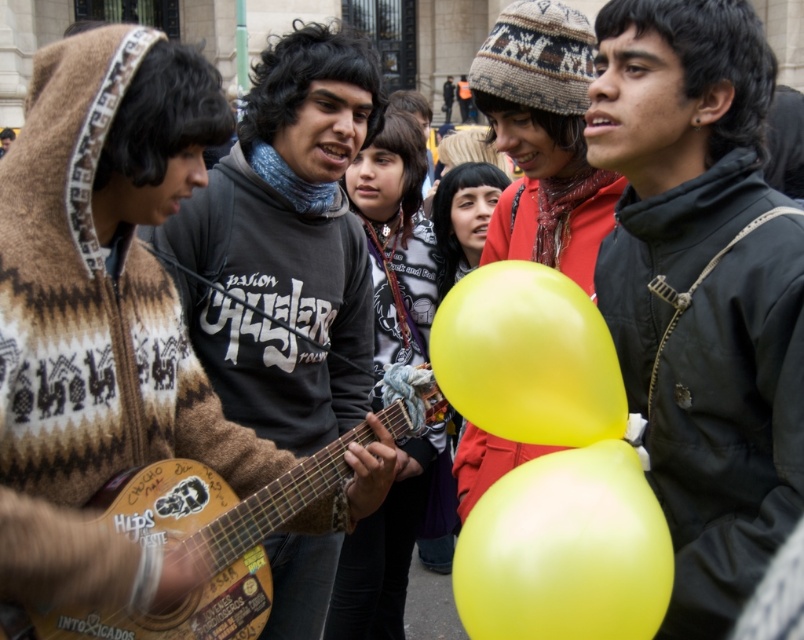
Which is in front, point (599, 253) or point (138, 504)?

Positioned in front is point (138, 504).

Between matte black jacket at center and wooden acoustic guitar at left, which one has less height?

Standing shorter between the two is wooden acoustic guitar at left.

In the scene shown: Who is more distant from viewer, (694, 186) or (113, 632)?

The point (694, 186) is more distant.

At what (x,y) coordinates should I click in order to perform the action: click on matte black jacket at center. Please return your answer as a coordinate pair (x, y). Looking at the image, I should click on (700, 289).

Who is taller, wooden acoustic guitar at left or yellow rubber balloon at center?

With more height is wooden acoustic guitar at left.

Which of these two, wooden acoustic guitar at left or yellow rubber balloon at center, stands shorter?

yellow rubber balloon at center

Between point (364, 429) and point (532, 420), which one is positioned behind?

Positioned behind is point (364, 429).

Locate an element on the screen. Image resolution: width=804 pixels, height=640 pixels. wooden acoustic guitar at left is located at coordinates (195, 547).

Does yellow matte balloon at center come in front of wooden acoustic guitar at left?

No, yellow matte balloon at center is further to the viewer.

Is yellow matte balloon at center to the right of wooden acoustic guitar at left from the viewer's perspective?

Correct, you'll find yellow matte balloon at center to the right of wooden acoustic guitar at left.

Does point (532, 589) come behind point (152, 625)?

Yes, it is behind point (152, 625).

Image resolution: width=804 pixels, height=640 pixels. Identify the location of yellow matte balloon at center. (565, 550).